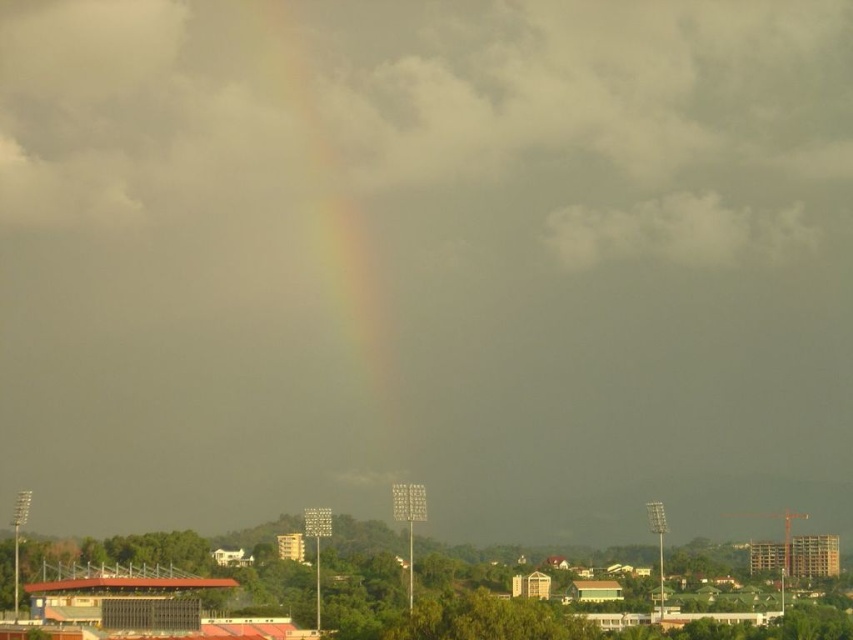
Between point (378, 307) and point (772, 252), which one is positioned behind?

Point (772, 252)

Is rainbow at center bigger than gray cotton cloud at upper center?

Correct, rainbow at center is larger in size than gray cotton cloud at upper center.

Is point (328, 198) closer to camera compared to point (708, 252)?

Yes, it is in front of point (708, 252).

The width and height of the screenshot is (853, 640). In order to click on rainbow at center in this screenshot , I will do `click(340, 234)`.